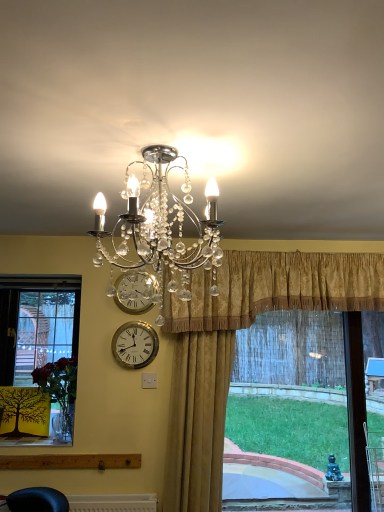
Question: Is gold metallic clock at upper center wider or thinner than gold velvet curtain at center, which appears as the first curtain when viewed from the left?

Choices:
 (A) wide
 (B) thin

Answer: (B)

Question: Visually, is gold metallic clock at upper center positioned to the left or to the right of gold velvet curtain at center, which appears as the first curtain when viewed from the left?

Choices:
 (A) right
 (B) left

Answer: (B)

Question: Considering the real-world distances, which object is closest to the gold metallic wall clock at lower center?

Choices:
 (A) clear crystal chandelier at upper center
 (B) gold metallic clock at upper center
 (C) gold velvet curtain at center, the second curtain positioned from the right
 (D) gold damask curtain at center, which is counted as the second curtain, starting from the left

Answer: (B)

Question: Which is farther from the clear crystal chandelier at upper center?

Choices:
 (A) gold metallic wall clock at lower center
 (B) gold velvet curtain at center, which appears as the first curtain when viewed from the left
 (C) gold metallic clock at upper center
 (D) gold damask curtain at center, which is counted as the second curtain, starting from the left

Answer: (B)